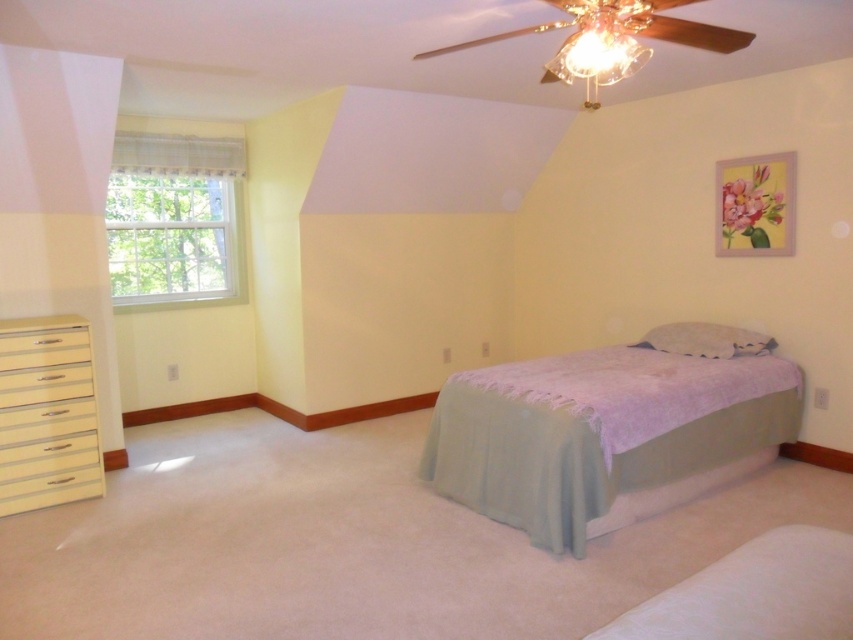
Does cream glossy dresser at lower left have a smaller size compared to white fabric pillow at center?

Incorrect, cream glossy dresser at lower left is not smaller in size than white fabric pillow at center.

Does cream glossy dresser at lower left appear on the right side of white fabric pillow at center?

No, cream glossy dresser at lower left is not to the right of white fabric pillow at center.

Is point (44, 500) closer to camera compared to point (650, 340)?

Yes, point (44, 500) is closer to viewer.

The image size is (853, 640). Find the location of `cream glossy dresser at lower left`. cream glossy dresser at lower left is located at coordinates pyautogui.click(x=47, y=413).

From the picture: Who is taller, light blue fabric bed at center or white fabric pillow at center?

light blue fabric bed at center is taller.

Does light blue fabric bed at center lie in front of white fabric pillow at center?

That is True.

Between point (496, 401) and point (669, 333), which one is positioned in front?

Point (496, 401)

Identify the location of light blue fabric bed at center. The width and height of the screenshot is (853, 640). (610, 429).

Is clear glass window at upper left positioned at the back of light blue fabric bedspread at center?

That is True.

Is clear glass window at upper left to the left of light blue fabric bedspread at center from the viewer's perspective?

Indeed, clear glass window at upper left is positioned on the left side of light blue fabric bedspread at center.

Which is behind, point (184, 294) or point (567, 388)?

Point (184, 294)

The height and width of the screenshot is (640, 853). Find the location of `clear glass window at upper left`. clear glass window at upper left is located at coordinates (175, 220).